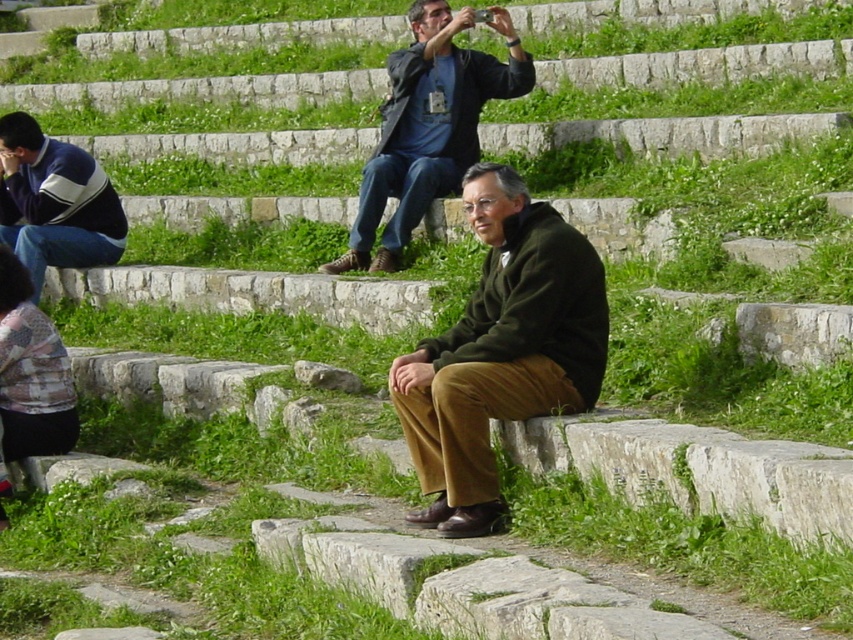
You are standing in the ancient amphitheater and see two points marked in the scene. Which point is nearer to you, point (495, 360) or point (390, 104)?

Point (495, 360) is closer to the viewer than point (390, 104).

You are standing at the amphitheater and want to place two markers at the coordinates point [408,433] and point [80,260]. Which marker will be closer to you when viewed from your current position?

Point [408,433] is closer to the viewer than point [80,260], so the marker at point [408,433] will be closer to you.

You are standing in the ancient amphitheater and see the dark green sweater at center and the dark blue jacket at upper center. Which one is positioned more to the right side?

The dark green sweater at center is positioned more to the right side than the dark blue jacket at upper center.